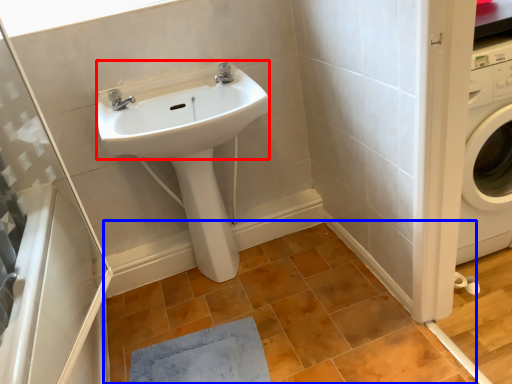
Question: Which object is closer to the camera taking this photo, sink (highlighted by a red box) or tile (highlighted by a blue box)?

Choices:
 (A) sink
 (B) tile

Answer: (B)